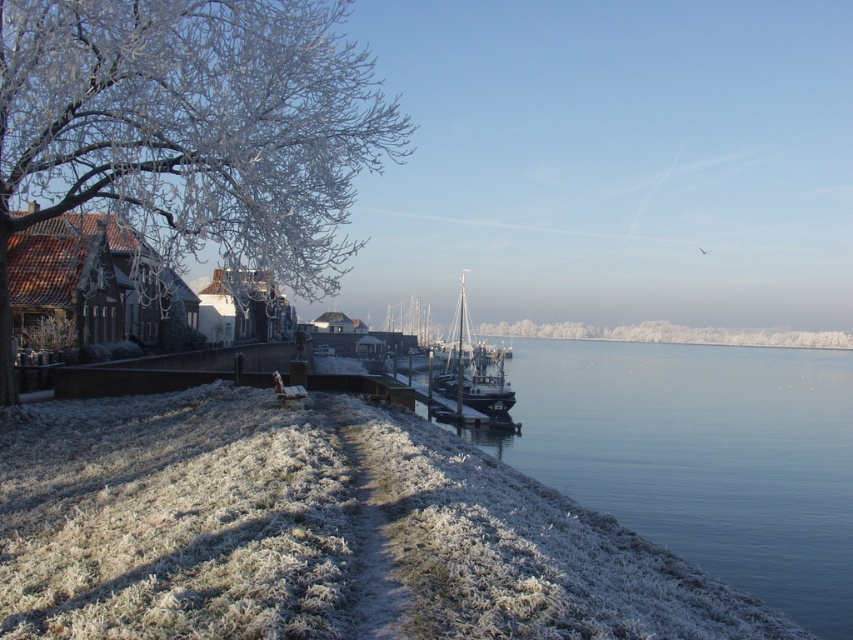
Question: Does frosted glass tree at left come in front of blue glassy water at lower left?

Choices:
 (A) no
 (B) yes

Answer: (A)

Question: Estimate the real-world distances between objects in this image. Which object is farther from the frosted glass tree at left?

Choices:
 (A) blue glassy water at lower left
 (B) white wooden sailboat at center

Answer: (A)

Question: Which of these objects is positioned farthest from the white wooden sailboat at center?

Choices:
 (A) blue glassy water at lower left
 (B) frosted glass tree at left

Answer: (B)

Question: Does frosted glass tree at left have a greater width compared to white wooden sailboat at center?

Choices:
 (A) yes
 (B) no

Answer: (A)

Question: Does frosted glass tree at left have a larger size compared to blue glassy water at lower left?

Choices:
 (A) no
 (B) yes

Answer: (B)

Question: Which object is closer to the camera taking this photo?

Choices:
 (A) white wooden sailboat at center
 (B) frosted glass tree at left
 (C) blue glassy water at lower left

Answer: (C)